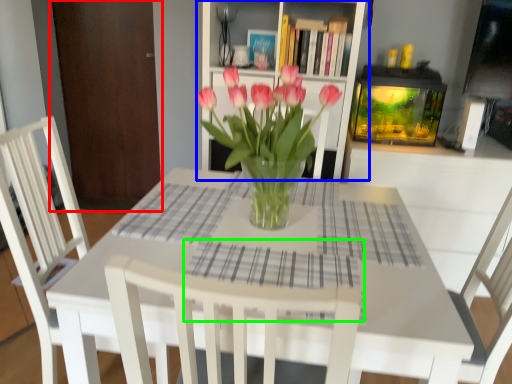
Question: Estimate the real-world distances between objects in this image. Which object is closer to armoire (highlighted by a red box), shelf (highlighted by a blue box) or plaid (highlighted by a green box)?

Choices:
 (A) shelf
 (B) plaid

Answer: (A)